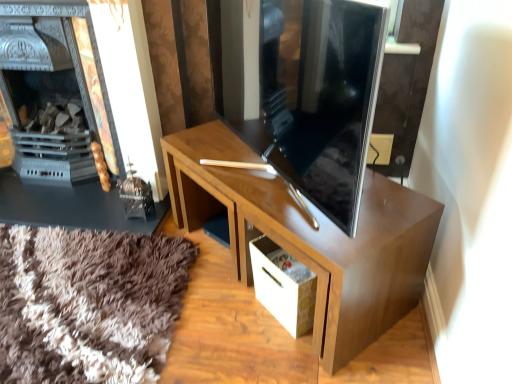
Locate an element on the screen. The width and height of the screenshot is (512, 384). free region on the left part of white cardboard drawer at lower center is located at coordinates (225, 312).